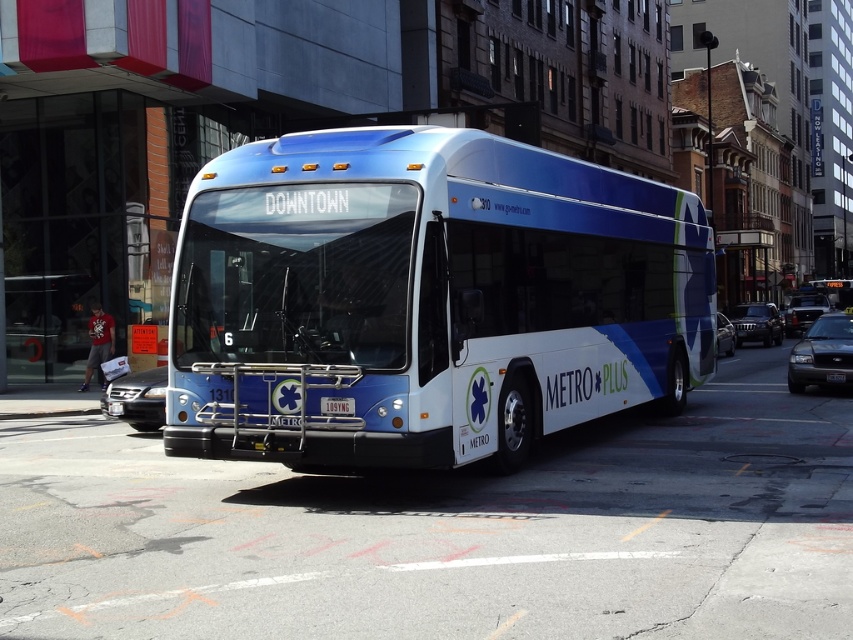
Question: From the image, what is the correct spatial relationship of metallic blue bus at center in relation to blue metallic bus at center?

Choices:
 (A) right
 (B) left

Answer: (B)

Question: Is metallic blue bus at center to the left of metallic glass bus stop at upper right from the viewer's perspective?

Choices:
 (A) yes
 (B) no

Answer: (A)

Question: Which object is the farthest from the shiny black suv at right?

Choices:
 (A) metallic blue bus at center
 (B) blue metallic bus at center

Answer: (A)

Question: Among these points, which one is nearest to the camera?

Choices:
 (A) (334, 401)
 (B) (828, 376)
 (C) (767, 260)
 (D) (720, 353)

Answer: (A)

Question: Can you confirm if shiny black suv at right is wider than black plastic license plate at center?

Choices:
 (A) yes
 (B) no

Answer: (A)

Question: Which object is closer to the camera taking this photo?

Choices:
 (A) shiny black sedan at right
 (B) black plastic license plate at center
 (C) metallic silver sedan at right

Answer: (A)